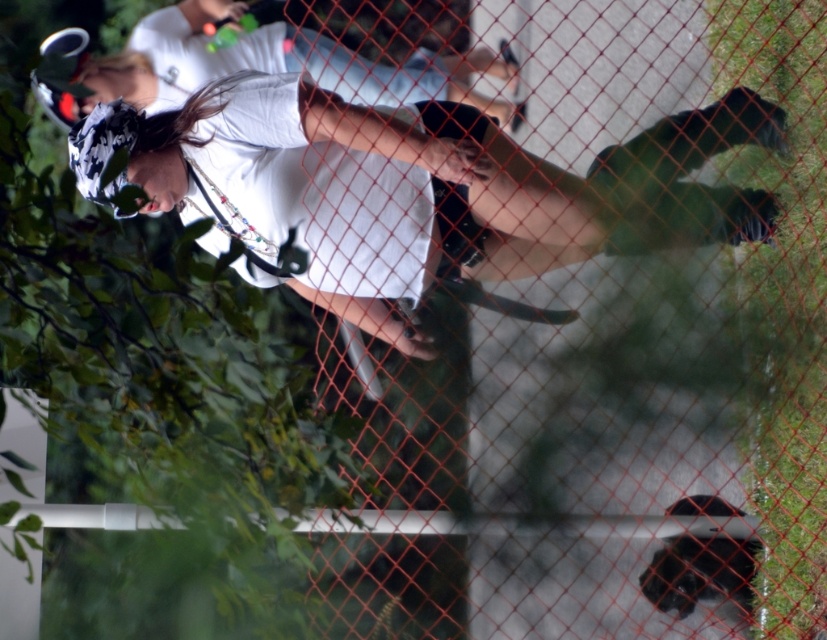
Measure the distance between point (466, 225) and camera.

A distance of 15.20 feet exists between point (466, 225) and camera.

Is point (304, 115) in front of point (326, 67)?

Yes, it is.

Measure the distance between white matte skateboard at center and camera.

white matte skateboard at center is 4.32 meters away from camera.

Find the location of a particular element. The height and width of the screenshot is (640, 827). white matte skateboard at center is located at coordinates (416, 189).